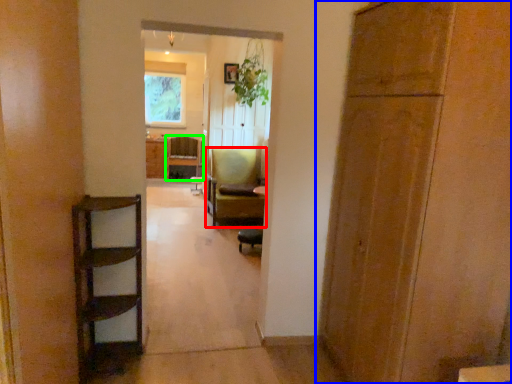
Question: Estimate the real-world distances between objects in this image. Which object is closer to chair (highlighted by a red box), door (highlighted by a blue box) or chair (highlighted by a green box)?

Choices:
 (A) door
 (B) chair

Answer: (B)